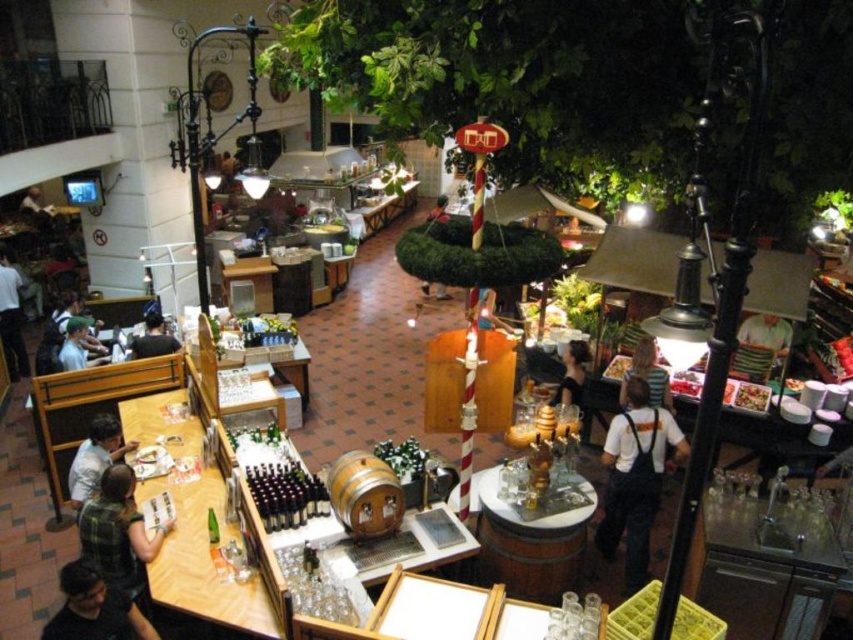
Question: Which of the following is the closest to the observer?

Choices:
 (A) (12, 272)
 (B) (114, 620)

Answer: (B)

Question: Which of the following is the farthest from the observer?

Choices:
 (A) (12, 340)
 (B) (496, 316)
 (C) (152, 554)
 (D) (74, 300)

Answer: (B)

Question: Can you confirm if white overalls at right is positioned to the left of smooth black shirt at center?

Choices:
 (A) yes
 (B) no

Answer: (B)

Question: Which point is farther to the camera?

Choices:
 (A) (144, 324)
 (B) (643, 353)

Answer: (A)

Question: Can you confirm if wooden barrel at center is smaller than green fabric shirt at left?

Choices:
 (A) no
 (B) yes

Answer: (A)

Question: Can you confirm if dark gray shirt at left is bigger than matte black shirt at left?

Choices:
 (A) yes
 (B) no

Answer: (A)